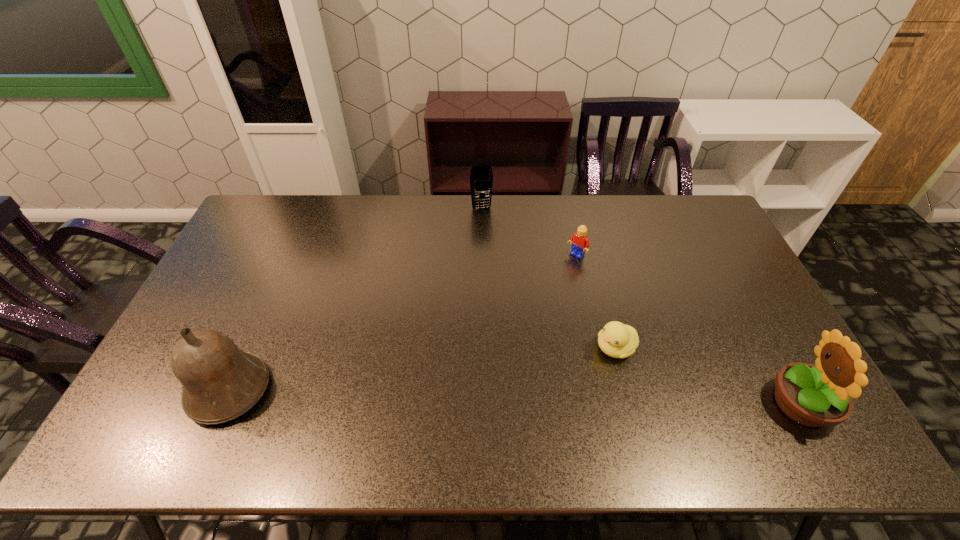
Identify the location of free spot between the Lego and the duckling. (596, 302).

You are a GUI agent. You are given a task and a screenshot of the screen. Output one action in this format:
    pyautogui.click(x=<x>, y=<y>)
    Task: Click on the object that is the closest to the leftmost object
    Image resolution: width=960 pixels, height=540 pixels.
    Given the screenshot: What is the action you would take?
    pyautogui.click(x=481, y=177)

Locate an element on the screen. Image resolution: width=960 pixels, height=540 pixels. object that can be found as the third closest to the cellular telephone is located at coordinates (220, 382).

Find the location of a particular element. This screenshot has height=540, width=960. free space that satisfies the following two spatial constraints: 1. on the front side of the fourth nearest object; 2. on the face of the rightmost object is located at coordinates (609, 403).

Identify the location of free space in the image that satisfies the following two spatial constraints: 1. on the back side of the Lego; 2. on the right side of the leftmost object. The image size is (960, 540). (288, 256).

At what (x,y) coordinates should I click in order to perform the action: click on free spot that satisfies the following two spatial constraints: 1. on the front side of the cellular telephone; 2. on the face of the sunflower. Please return your answer as a coordinate pair (x, y). Looking at the image, I should click on (482, 403).